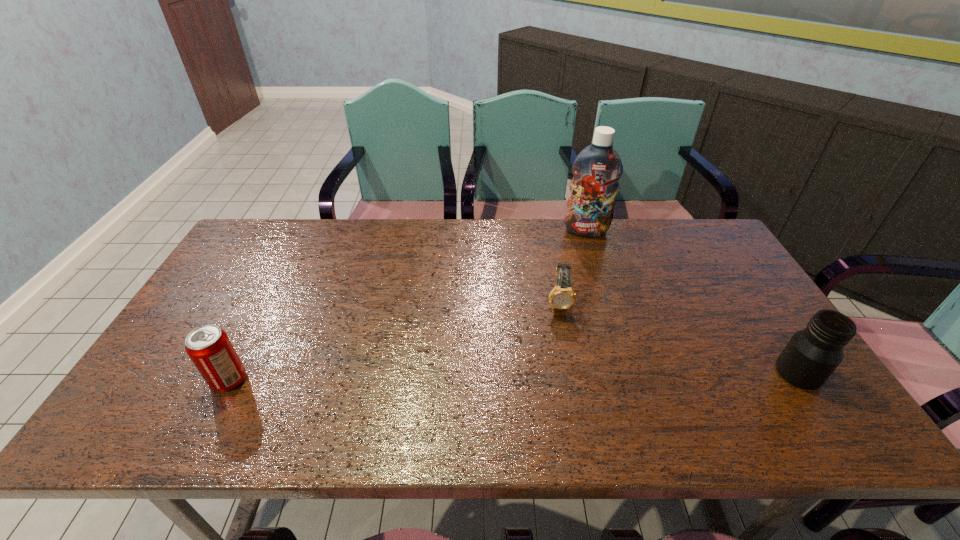
The image size is (960, 540). I want to click on free spot that satisfies the following two spatial constraints: 1. on the front side of the shortest object; 2. on the right side of the rightmost object, so click(x=572, y=373).

Find the location of a particular element. Image resolution: width=960 pixels, height=540 pixels. vacant space that satisfies the following two spatial constraints: 1. on the front side of the rightmost object; 2. on the left side of the shortest object is located at coordinates (572, 373).

The width and height of the screenshot is (960, 540). Find the location of `vacant space that satisfies the following two spatial constraints: 1. on the front side of the rightmost object; 2. on the right side of the third object from right to left`. vacant space that satisfies the following two spatial constraints: 1. on the front side of the rightmost object; 2. on the right side of the third object from right to left is located at coordinates (572, 373).